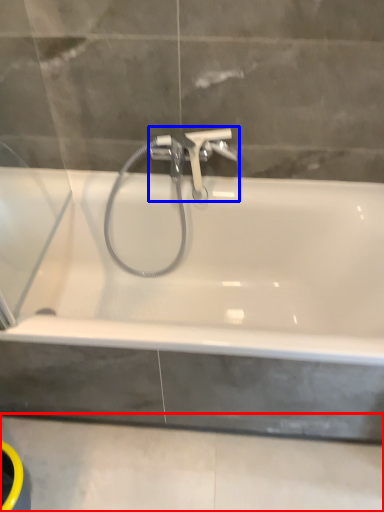
Question: Which object appears closest to the camera in this image, concrete (highlighted by a red box) or tap (highlighted by a blue box)?

Choices:
 (A) concrete
 (B) tap

Answer: (A)